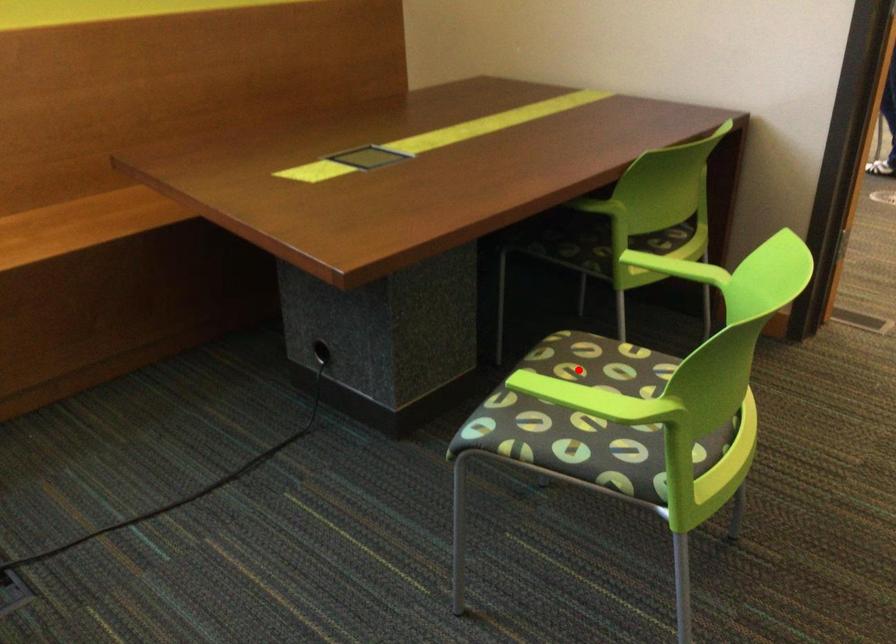
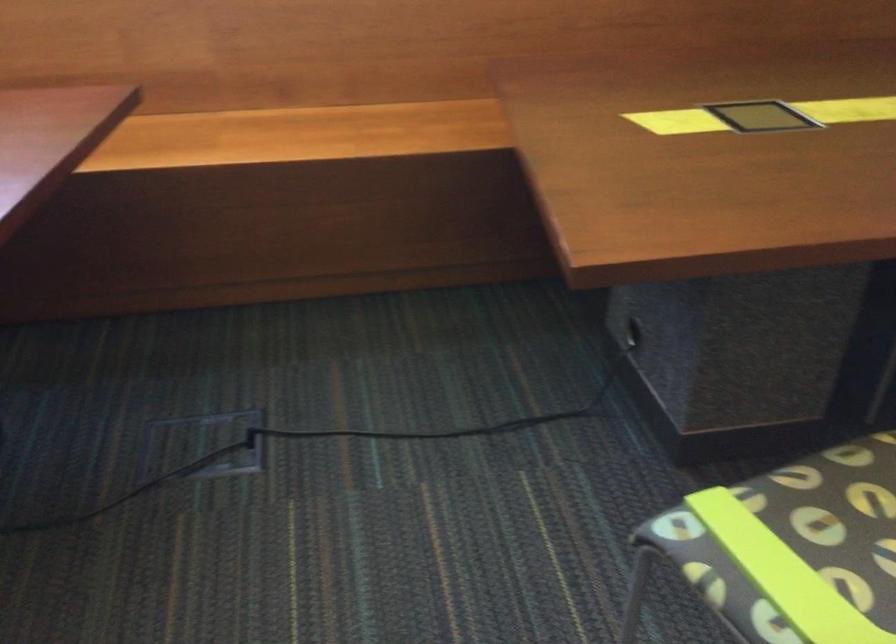
Question: I am providing you with two images of the same scene from different viewpoints. Image1 has a red point marked. In image2, the corresponding 3D location appears at what relative position? Reply with the corresponding letter.

Choices:
 (A) Closer
 (B) Farther

Answer: (A)